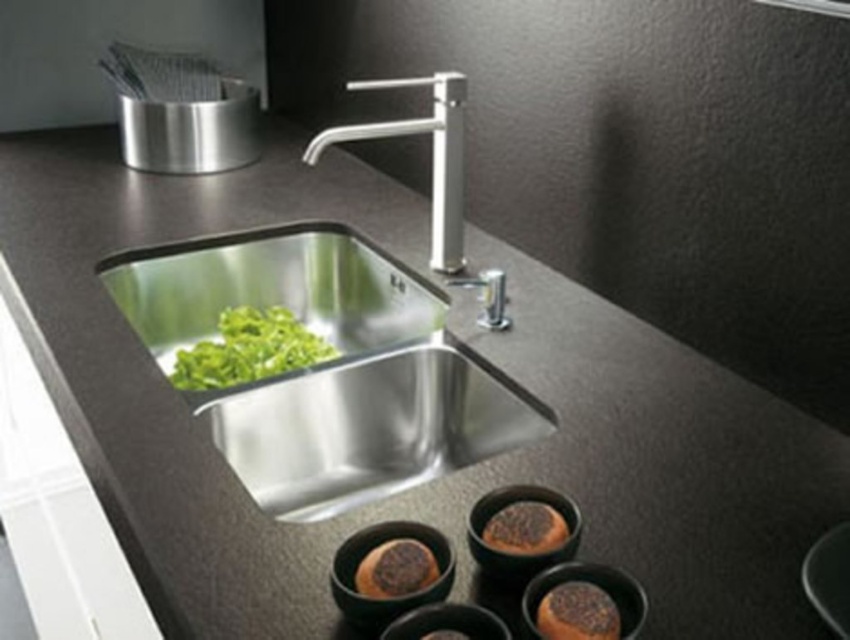
Who is lower down, stainless steel sink at center or brown crumbly bread at lower right?

brown crumbly bread at lower right

Does stainless steel sink at center lie behind brown crumbly bread at lower right?

Yes, it is behind brown crumbly bread at lower right.

You are a GUI agent. You are given a task and a screenshot of the screen. Output one action in this format:
    pyautogui.click(x=<x>, y=<y>)
    Task: Click on the stainless steel sink at center
    
    Given the screenshot: What is the action you would take?
    pyautogui.click(x=327, y=365)

Does polished stainless steel faucet at upper center appear on the left side of brown crumbly bread at lower right?

Correct, you'll find polished stainless steel faucet at upper center to the left of brown crumbly bread at lower right.

Is polished stainless steel faucet at upper center wider than brown crumbly bread at lower right?

Yes.

The image size is (850, 640). I want to click on polished stainless steel faucet at upper center, so point(431,160).

Is green leafy vegetable at center taller than brown crumbly bread at lower center?

Yes.

Locate an element on the screen. The width and height of the screenshot is (850, 640). green leafy vegetable at center is located at coordinates (248, 349).